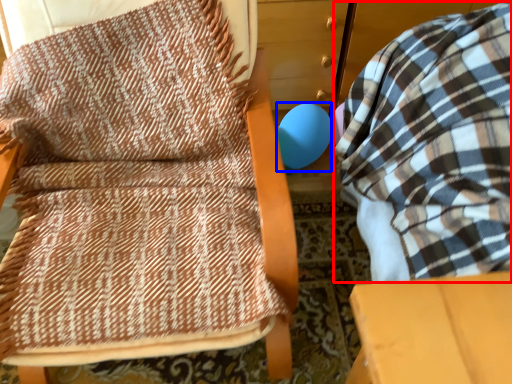
Question: Among these objects, which one is farthest to the camera, bean bag chair (highlighted by a red box) or balloon (highlighted by a blue box)?

Choices:
 (A) bean bag chair
 (B) balloon

Answer: (B)